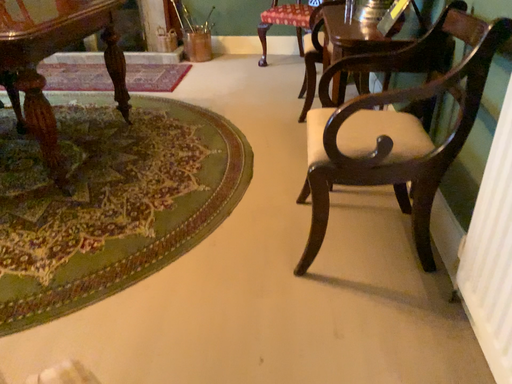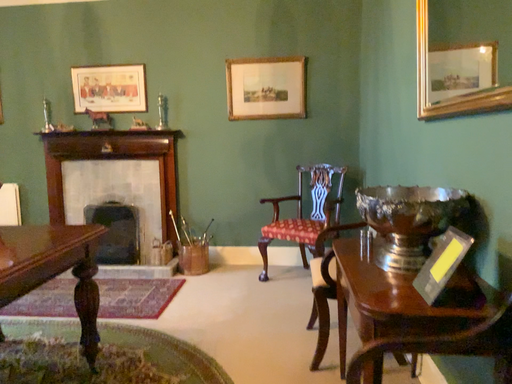
Question: Which way did the camera rotate in the video?

Choices:
 (A) rotated upward
 (B) rotated downward

Answer: (A)